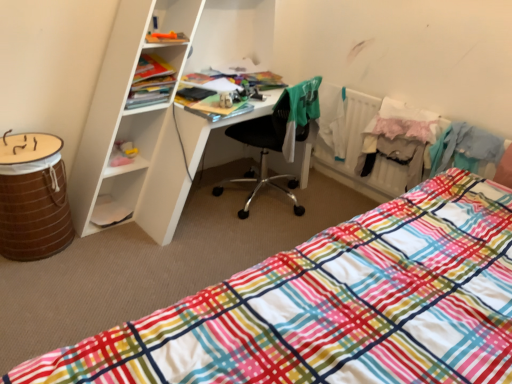
Identify the location of free space that is in between black plastic chair at center and brown woven barrel at lower left. Image resolution: width=512 pixels, height=384 pixels. (179, 226).